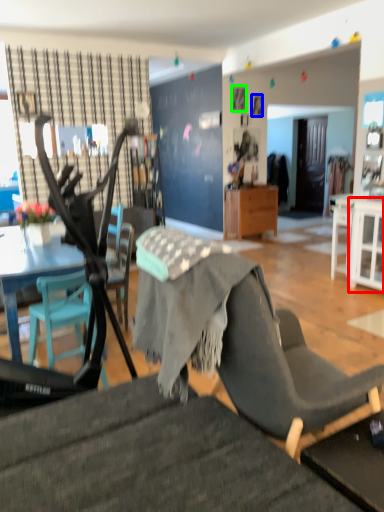
Question: Which object is positioned closest to cabinetry (highlighted by a red box)? Select from picture frame (highlighted by a blue box) and picture frame (highlighted by a green box).

Choices:
 (A) picture frame
 (B) picture frame

Answer: (A)